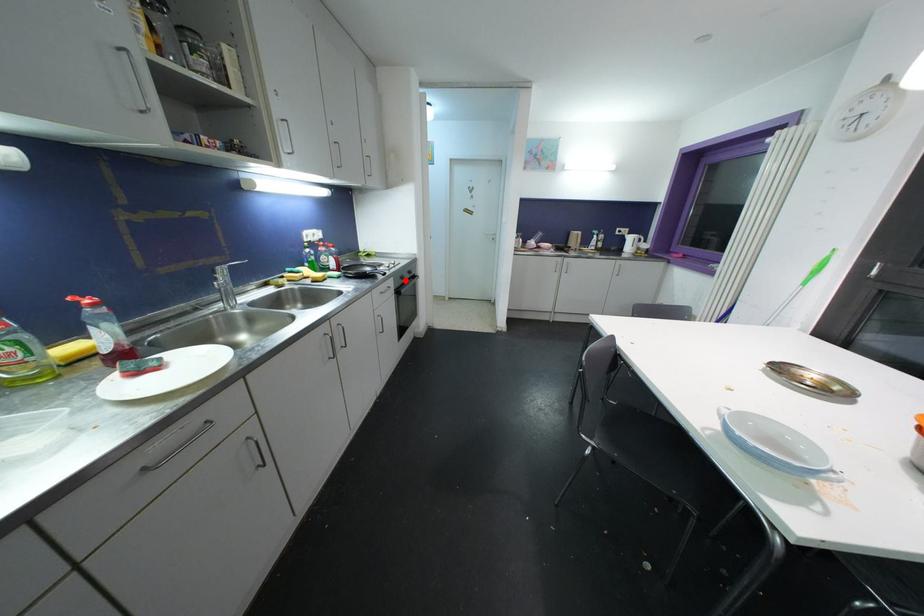
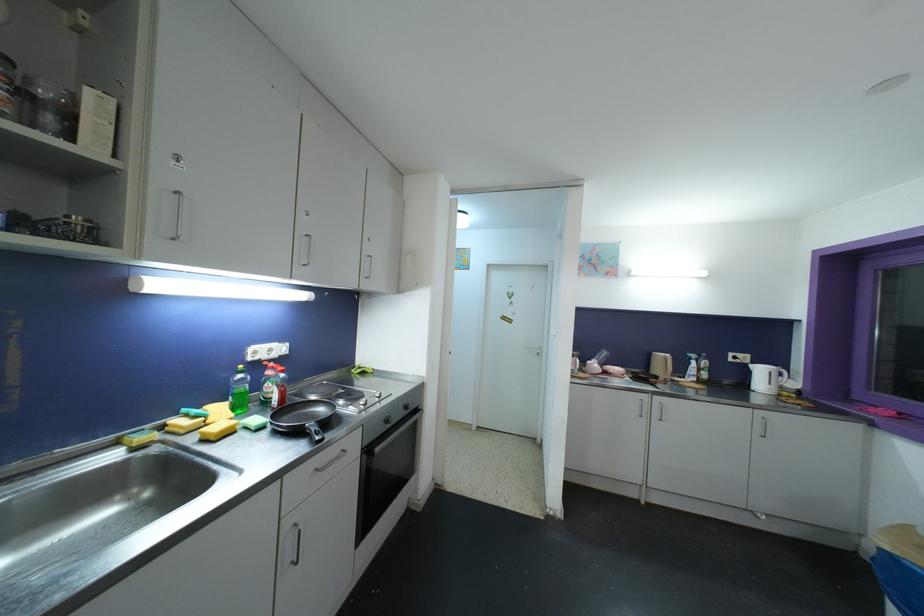
Find the pixel in the second image that matches the highlighted location in the first image.

(390, 424)